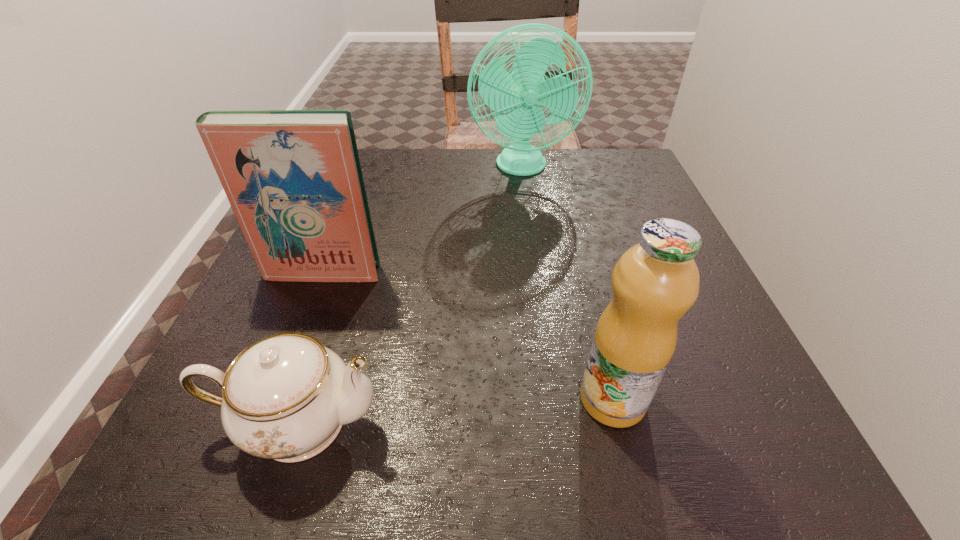
Locate an element on the screen. The image size is (960, 540). hardback book at the left edge is located at coordinates 293,178.

This screenshot has width=960, height=540. Find the location of `chinaware that is at the left edge`. chinaware that is at the left edge is located at coordinates (285, 397).

Where is `object that is at the near left corner`? The width and height of the screenshot is (960, 540). object that is at the near left corner is located at coordinates (285, 397).

Identify the location of vacant space at the far edge. (411, 168).

The width and height of the screenshot is (960, 540). In order to click on vacant region at the left edge in this screenshot , I will do `click(276, 291)`.

Image resolution: width=960 pixels, height=540 pixels. I want to click on vacant area at the right edge of the desktop, so click(x=597, y=208).

Where is `blank area at the far left corner`? blank area at the far left corner is located at coordinates (369, 187).

This screenshot has width=960, height=540. I want to click on vacant space at the near left corner of the desktop, so click(271, 474).

Find the location of a particular element. blank space at the far right corner of the desktop is located at coordinates click(x=583, y=158).

At what (x,y) coordinates should I click in order to perform the action: click on free spot between the fruit juice and the farthest object. Please return your answer as a coordinate pair (x, y). Looking at the image, I should click on (567, 283).